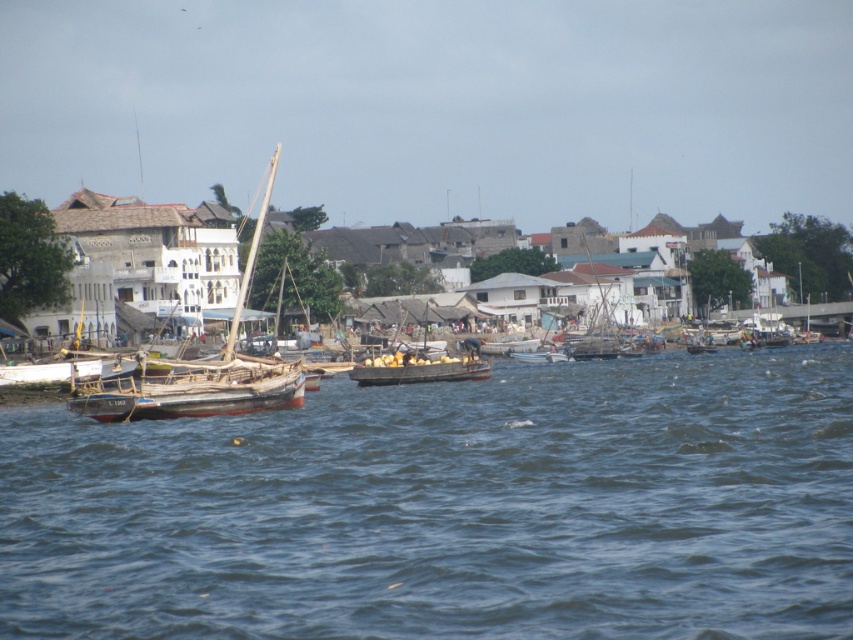
Between point (61, 497) and point (231, 304), which one is positioned behind?

The point (231, 304) is more distant.

The image size is (853, 640). Find the location of `blue water at center`. blue water at center is located at coordinates (450, 508).

What are the coordinates of `blue water at center` in the screenshot? It's located at coord(450,508).

Is blue water at center taller than wooden boat at center?

Correct, blue water at center is much taller as wooden boat at center.

Which is above, blue water at center or wooden boat at center?

Positioned higher is wooden boat at center.

Does point (389, 413) lie in front of point (424, 346)?

That is True.

Where is `blue water at center`? blue water at center is located at coordinates (450, 508).

Can you confirm if wooden sailboat at left is positioned to the left of wooden boat at center?

Correct, you'll find wooden sailboat at left to the left of wooden boat at center.

Does wooden sailboat at left lie behind wooden boat at center?

No, wooden sailboat at left is in front of wooden boat at center.

The image size is (853, 640). In order to click on wooden sailboat at left in this screenshot , I will do `click(178, 304)`.